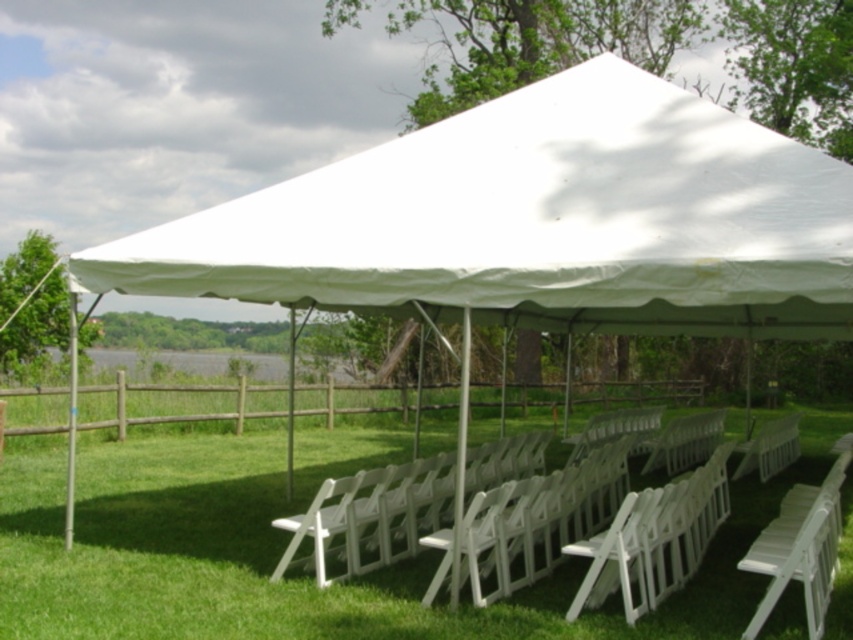
Question: Which of the following is the closest to the observer?

Choices:
 (A) (782, 497)
 (B) (747, 465)

Answer: (A)

Question: Which point appears closest to the camera in this image?

Choices:
 (A) (776, 444)
 (B) (672, 577)

Answer: (B)

Question: Which point is farther to the camera?

Choices:
 (A) tap(785, 424)
 (B) tap(505, 588)

Answer: (A)

Question: Is white plastic chairs at center bigger than white plastic chair at center?

Choices:
 (A) yes
 (B) no

Answer: (A)

Question: Is white plastic chairs at center smaller than white plastic chair at center?

Choices:
 (A) no
 (B) yes

Answer: (A)

Question: Does white plastic chairs at center appear under white plastic chair at center?

Choices:
 (A) yes
 (B) no

Answer: (B)